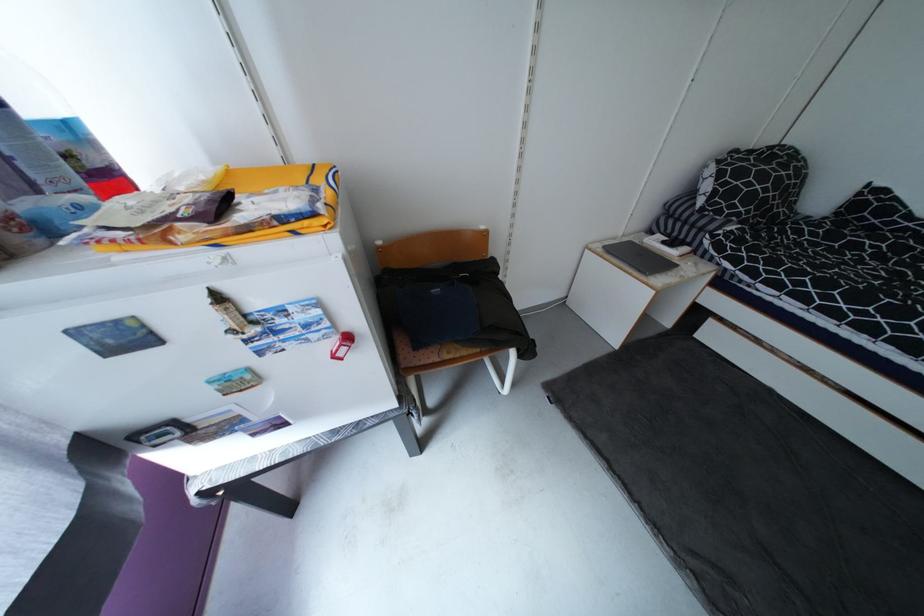
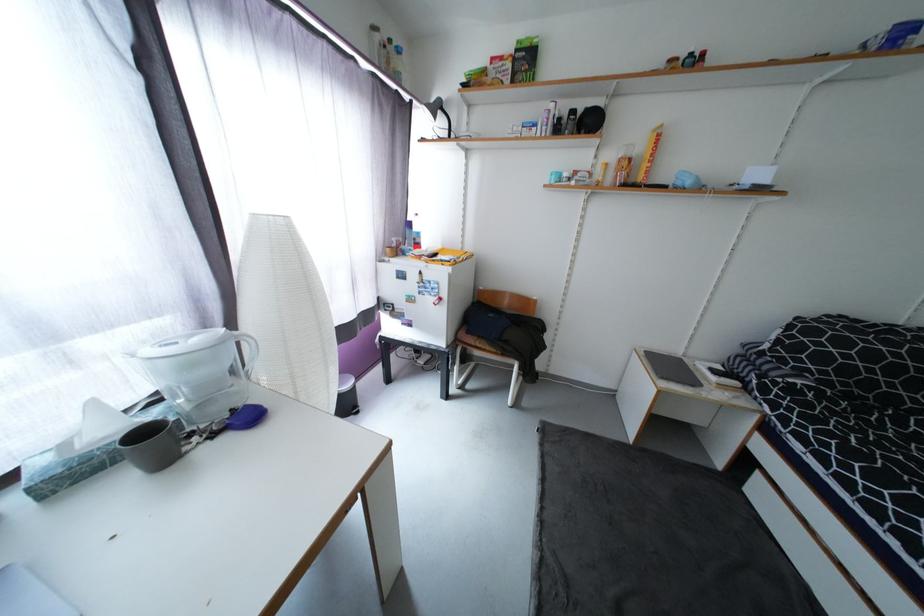
Question: I am providing you with two images of the same scene from different viewpoints. Please identify which objects are invisible in image2.

Choices:
 (A) small blue cup
 (B) green tissue box
 (C) green snack box
 (D) none of these

Answer: (D)